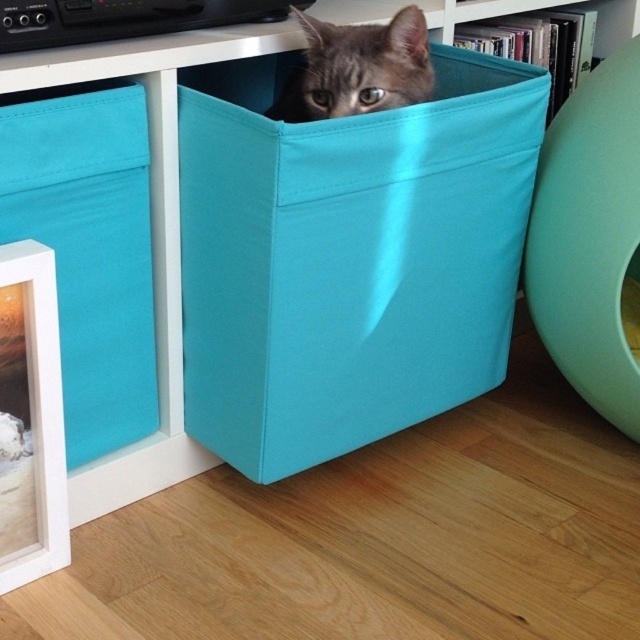
Question: Considering the real-world distances, which object is farthest from the teal fabric box at center?

Choices:
 (A) teal fabric box at left
 (B) gray fabric cat at upper center

Answer: (B)

Question: Does teal fabric box at left have a smaller size compared to gray fabric cat at upper center?

Choices:
 (A) yes
 (B) no

Answer: (B)

Question: Can you confirm if teal fabric box at center is positioned to the left of gray fabric cat at upper center?

Choices:
 (A) no
 (B) yes

Answer: (A)

Question: Which point is closer to the camera?

Choices:
 (A) (22, 173)
 (B) (464, 230)

Answer: (A)

Question: Is teal fabric box at center below teal fabric box at left?

Choices:
 (A) no
 (B) yes

Answer: (A)

Question: Which of the following is the farthest from the observer?

Choices:
 (A) (371, 51)
 (B) (440, 308)
 (C) (115, 385)

Answer: (B)